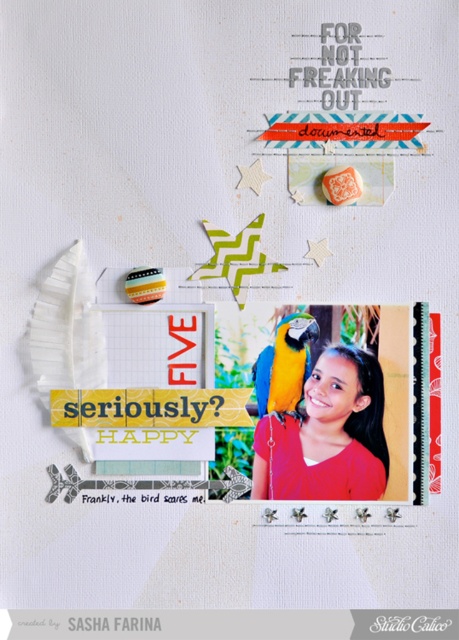
Question: Is matte pink shirt at center above blue/gold macaw at center?

Choices:
 (A) no
 (B) yes

Answer: (A)

Question: Which object appears farthest from the camera in this image?

Choices:
 (A) matte pink shirt at center
 (B) blue/gold macaw at center

Answer: (B)

Question: Can you confirm if matte pink shirt at center is wider than blue/gold macaw at center?

Choices:
 (A) yes
 (B) no

Answer: (A)

Question: Does matte pink shirt at center have a larger size compared to blue/gold macaw at center?

Choices:
 (A) no
 (B) yes

Answer: (B)

Question: Which point is farther from the camera taking this photo?

Choices:
 (A) (313, 339)
 (B) (261, 428)

Answer: (B)